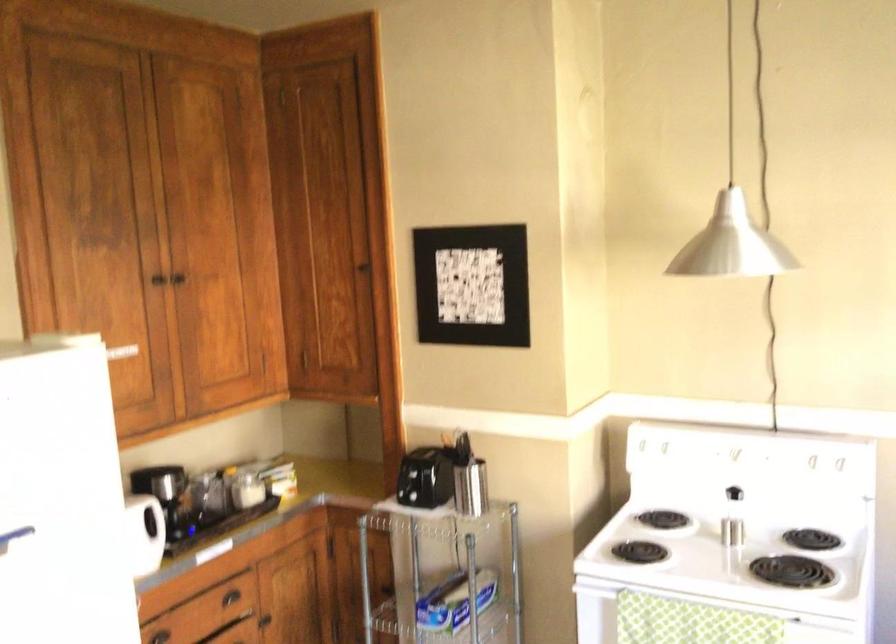
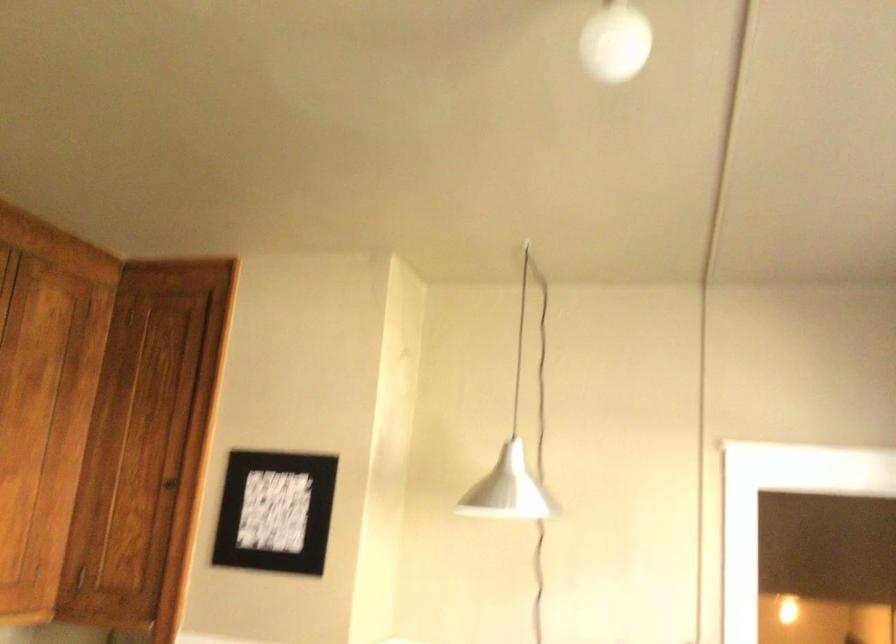
The point at [705,252] is marked in the first image. Where is the corresponding point in the second image?

(507, 489)